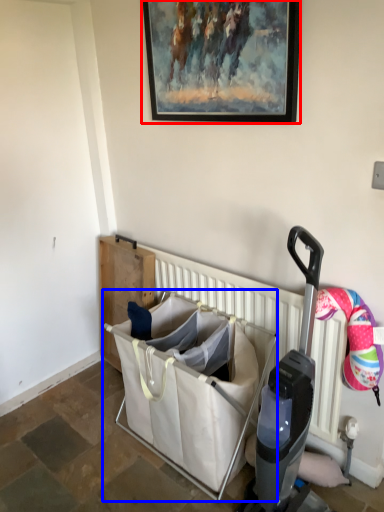
Question: Which point is closer to the camera, picture frame (highlighted by a red box) or baby carriage (highlighted by a blue box)?

Choices:
 (A) picture frame
 (B) baby carriage

Answer: (A)